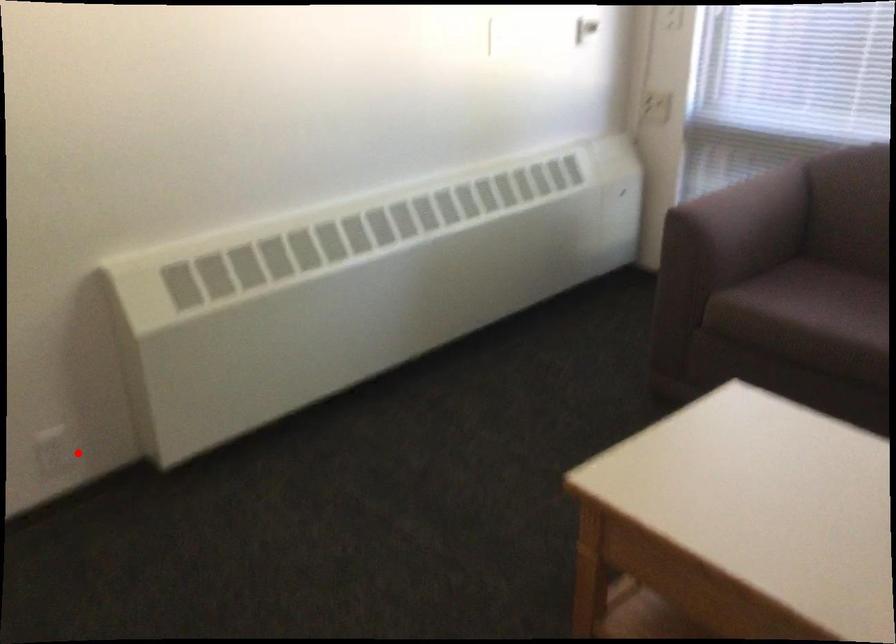
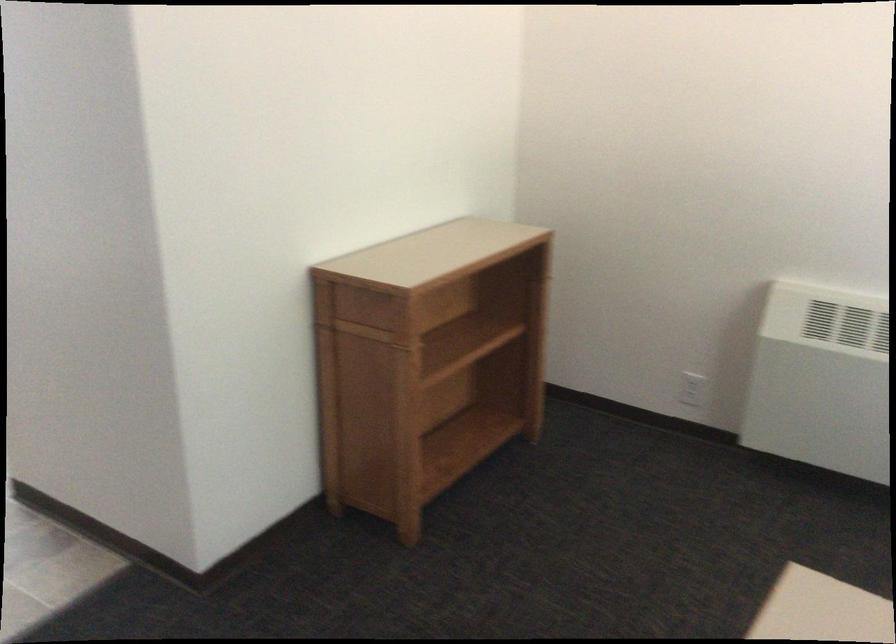
Locate, in the second image, the point that corresponds to the highlighted location in the first image.

(692, 389)